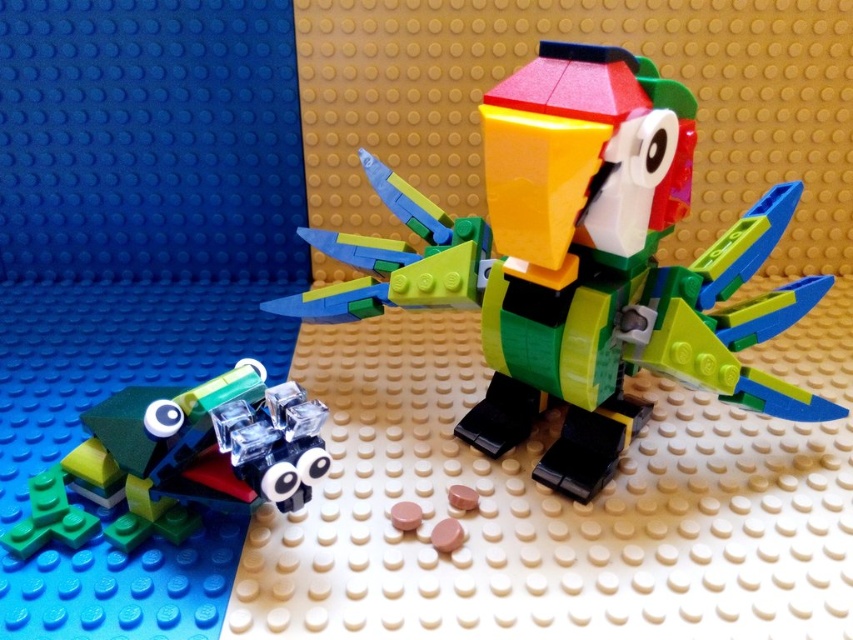
You are a child who wants to place a new LEGO brick between the multicolored plastic parrot at center and the translucent green plastic frog at lower left. According to the image, which direction should you place the brick to keep it between them?

You should place the brick to the left of the multicolored plastic parrot at center or to the right of the translucent green plastic frog at lower left to keep it between them since the parrot is to the right of the frog.

You are a robot trying to place a sticker on the multicolored plastic parrot at center. The sticker is placed at coordinate point 0.414, 0.680. Is the sticker on the parrot?

Yes, the sticker is on the multicolored plastic parrot at center because its 2D location is exactly at point (579, 264).

You are a child who wants to reach the multicolored plastic parrot at center on the beige baseplate. The child is standing 24 inches away from the LEGO creations. Can the child reach the parrot without moving closer?

The multicolored plastic parrot at center is 27.22 inches from the viewer, and the child is standing 24 inches away. Since the parrot is farther away than the child is standing, the child cannot reach it without moving closer.